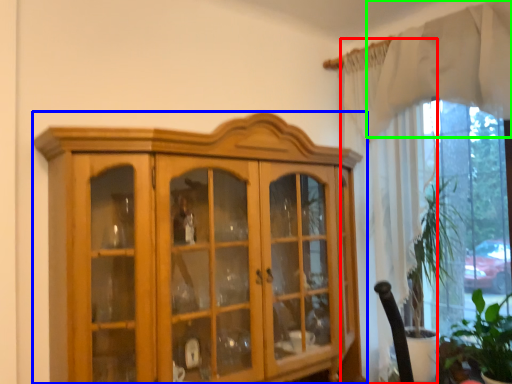
Question: Which is farther away from curtain (highlighted by a red box)? cupboard (highlighted by a blue box) or curtain (highlighted by a green box)?

Choices:
 (A) cupboard
 (B) curtain

Answer: (A)